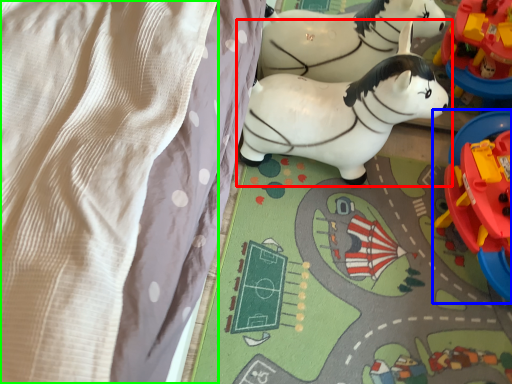
Question: Which object is the farthest from toy (highlighted by a red box)? Choose among these: toy (highlighted by a blue box) or blanket (highlighted by a green box).

Choices:
 (A) toy
 (B) blanket

Answer: (B)